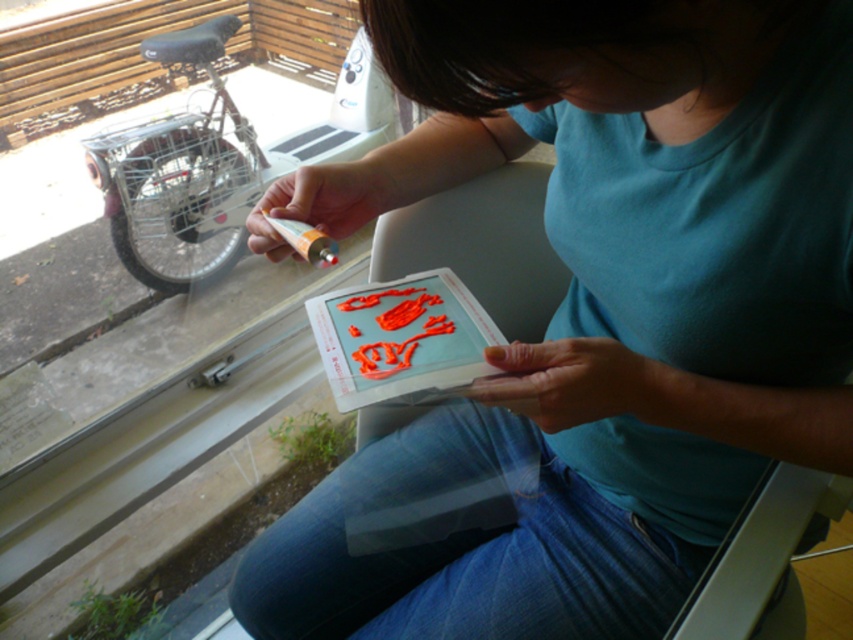
You are an artist trying to reach for an object in the center of the scene. There are two items there, the matte orange marker at center and the glossy plastic card at center. Which one is closer to you?

The matte orange marker at center is closer to the viewer than the glossy plastic card at center.